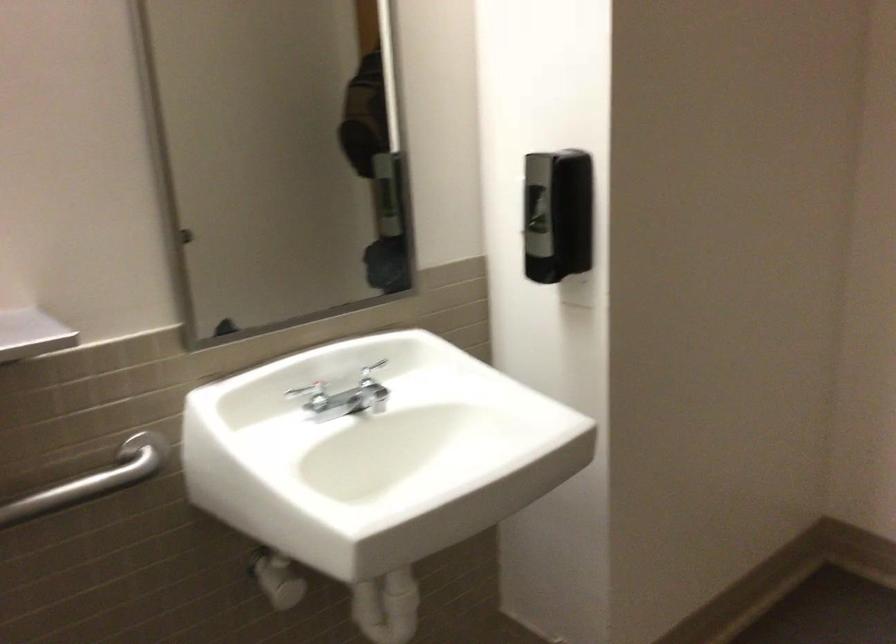
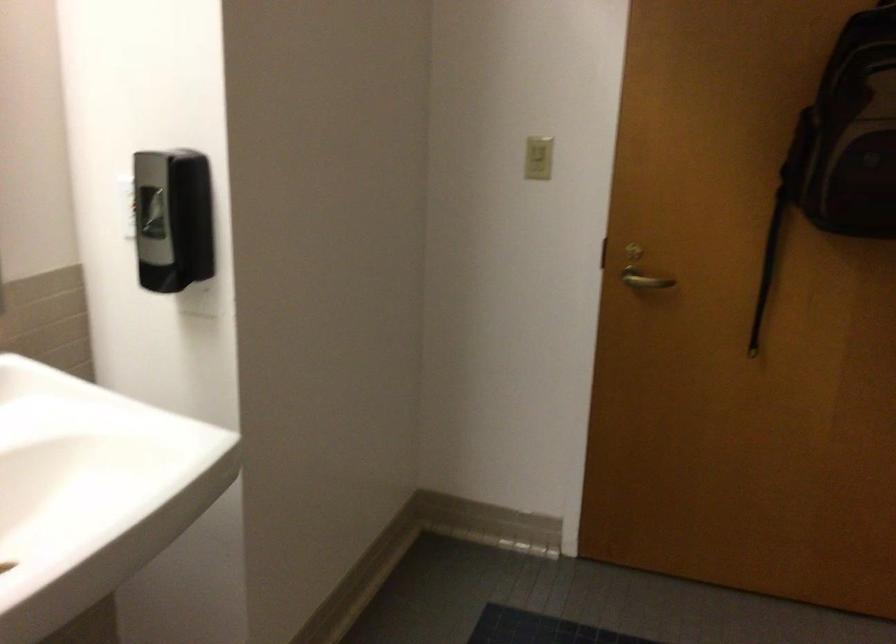
Where in the second image is the point corresponding to point 535,207 from the first image?

(150, 212)